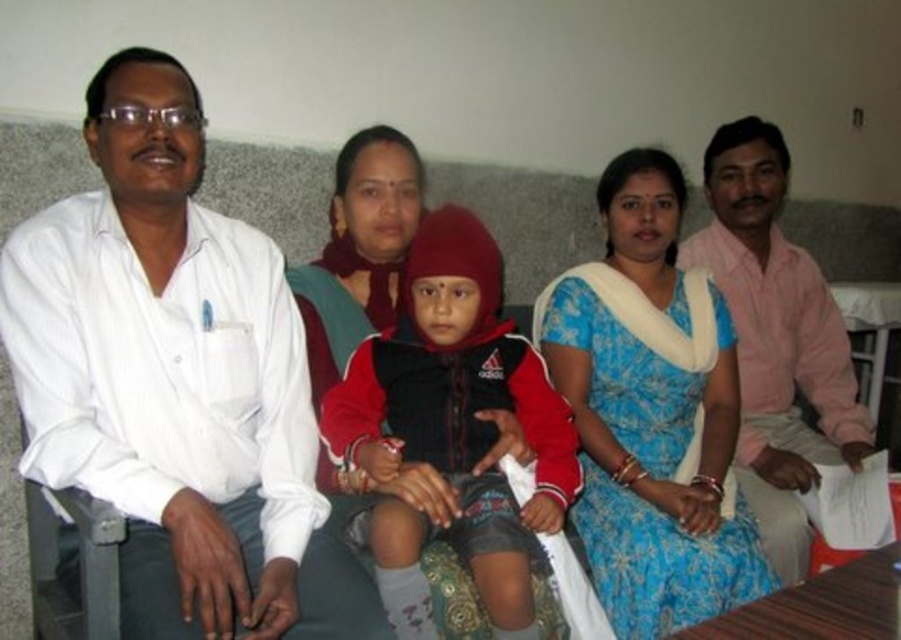
Does white shirt at left appear under blue floral saree at center?

Actually, white shirt at left is above blue floral saree at center.

Between white shirt at left and blue floral saree at center, which one appears on the right side from the viewer's perspective?

blue floral saree at center is more to the right.

Which is in front, point (178, 586) or point (698, 413)?

Point (178, 586)

Identify the location of white shirt at left. The height and width of the screenshot is (640, 901). (168, 371).

Does white shirt at left have a smaller size compared to red fleece jacket at center?

Actually, white shirt at left might be larger than red fleece jacket at center.

This screenshot has width=901, height=640. What do you see at coordinates (168, 371) in the screenshot?
I see `white shirt at left` at bounding box center [168, 371].

Where is `white shirt at left`? The image size is (901, 640). white shirt at left is located at coordinates (168, 371).

What do you see at coordinates (652, 413) in the screenshot? This screenshot has height=640, width=901. I see `blue floral saree at center` at bounding box center [652, 413].

The width and height of the screenshot is (901, 640). What do you see at coordinates (652, 413) in the screenshot?
I see `blue floral saree at center` at bounding box center [652, 413].

Identify the location of blue floral saree at center. coord(652,413).